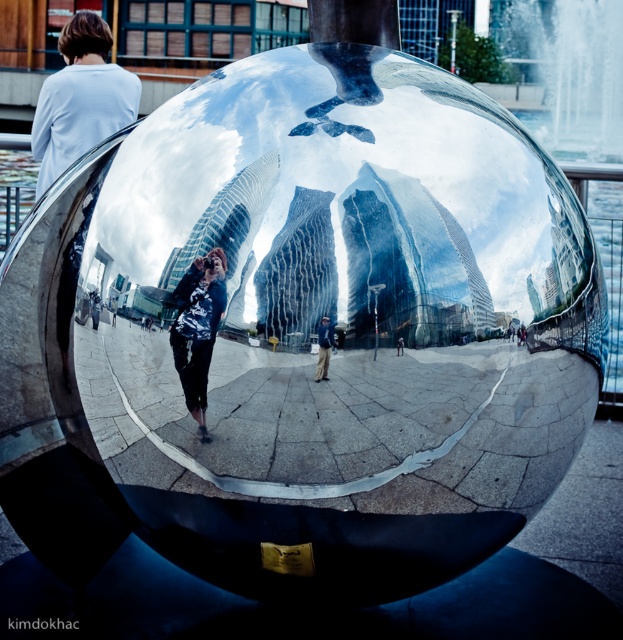
You are an observer standing in front of the reflective metallic sphere sculpture. You notice two jackets reflected in the sphere. Which jacket, the matte black jacket at center or the light brown leather jacket at center, appears bigger in the reflection?

The matte black jacket at center appears bigger in the reflection because it has a larger size compared to the light brown leather jacket at center.